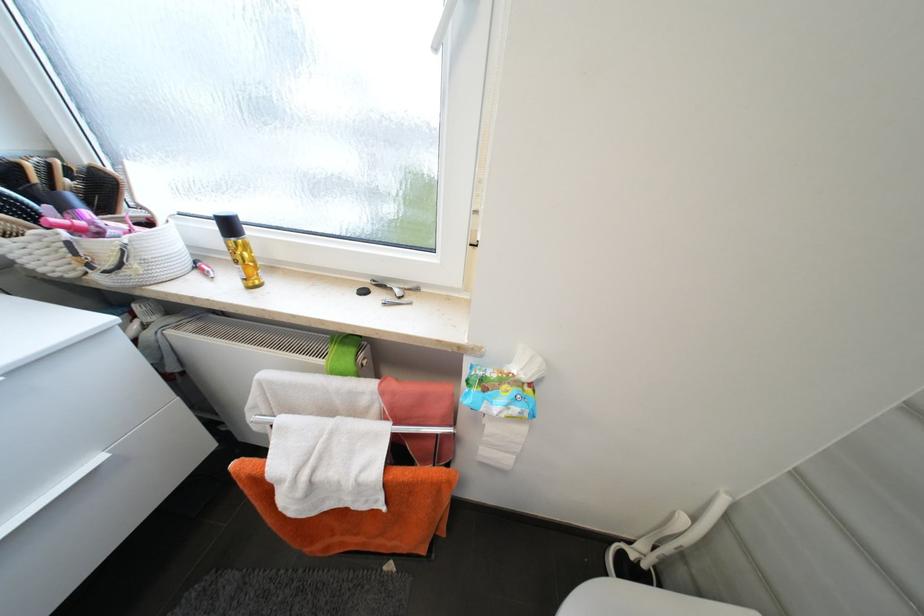
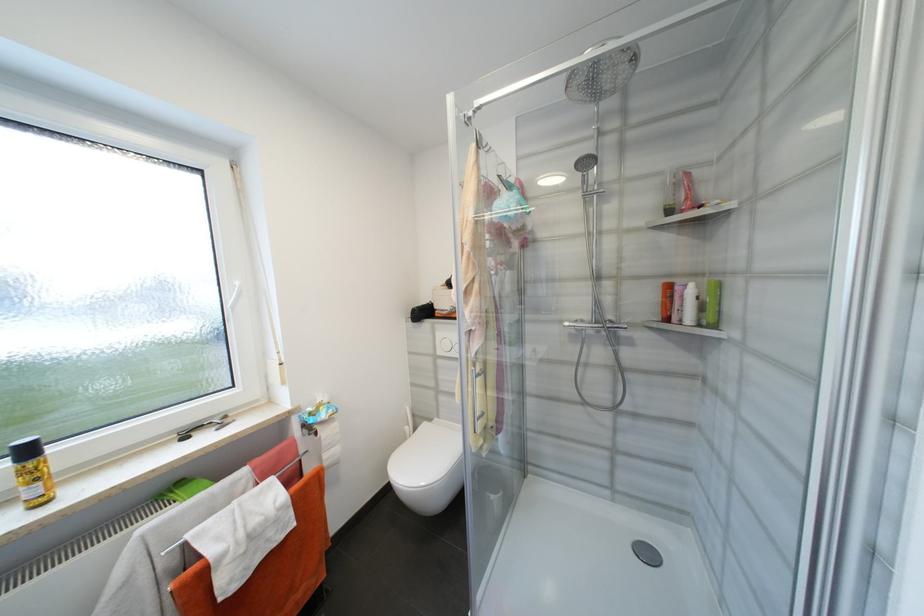
Find the pixel in the second image that matches point 235,228 in the first image.

(33, 453)